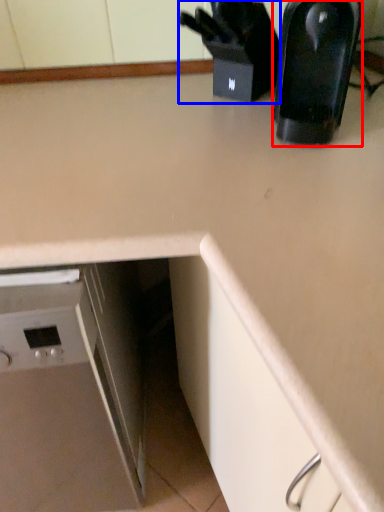
Question: Which object appears closest to the camera in this image, kitchen appliance (highlighted by a red box) or appliance (highlighted by a blue box)?

Choices:
 (A) kitchen appliance
 (B) appliance

Answer: (A)